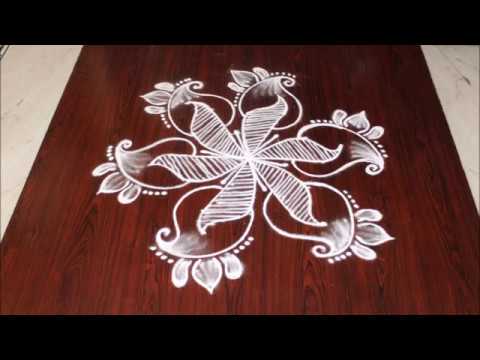
This screenshot has width=480, height=360. I want to click on marble on left side, so click(x=32, y=98).